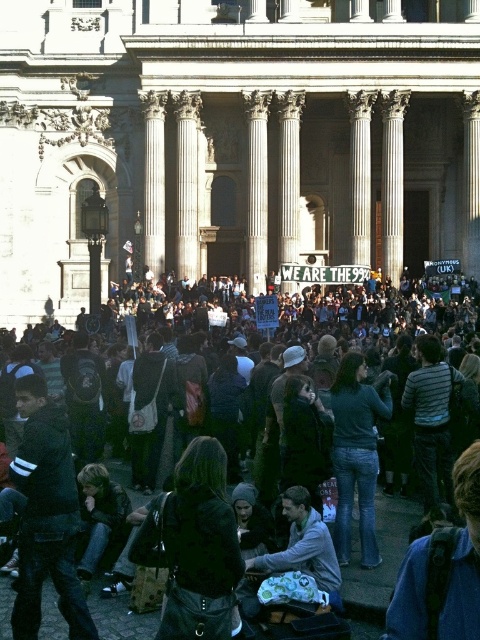
What do you see at coordinates (47, 515) in the screenshot? I see `black fabric jacket at lower left` at bounding box center [47, 515].

You are a GUI agent. You are given a task and a screenshot of the screen. Output one action in this format:
    pyautogui.click(x=<x>, y=<y>)
    Task: Click on the black fabric jacket at lower left
    
    Given the screenshot: What is the action you would take?
    pyautogui.click(x=47, y=515)

Which is more to the left, black leather jacket at center or gray fabric jacket at center?

Positioned to the left is black leather jacket at center.

Which of these two, black leather jacket at center or gray fabric jacket at center, stands taller?

Standing taller between the two is black leather jacket at center.

Where is `black leather jacket at center`? The height and width of the screenshot is (640, 480). black leather jacket at center is located at coordinates (194, 547).

Who is more distant from viewer, (81, 630) or (338, 595)?

The point (338, 595) is more distant.

Who is more distant from viewer, (58, 448) or (309, 544)?

Positioned behind is point (309, 544).

The height and width of the screenshot is (640, 480). In order to click on black fabric jacket at lower left in this screenshot , I will do `click(47, 515)`.